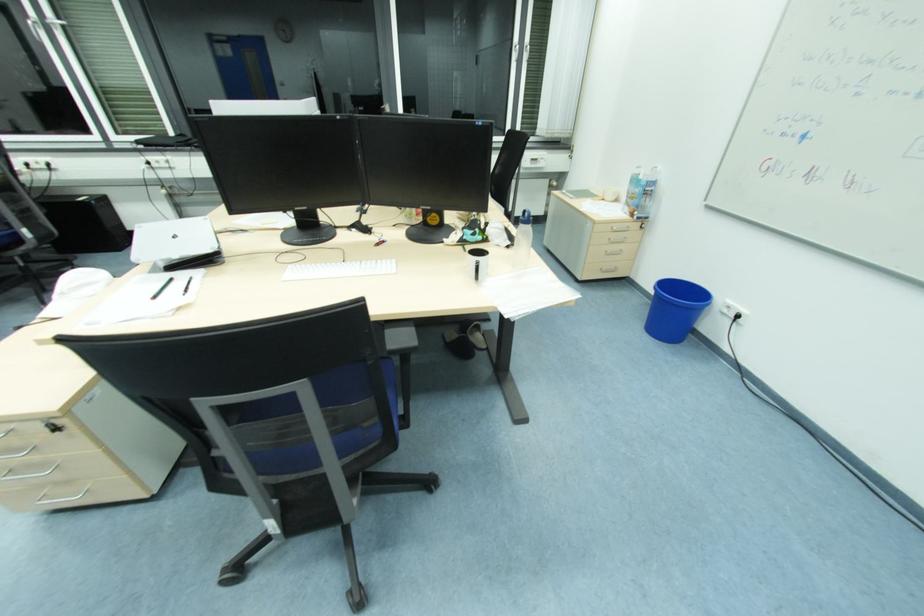
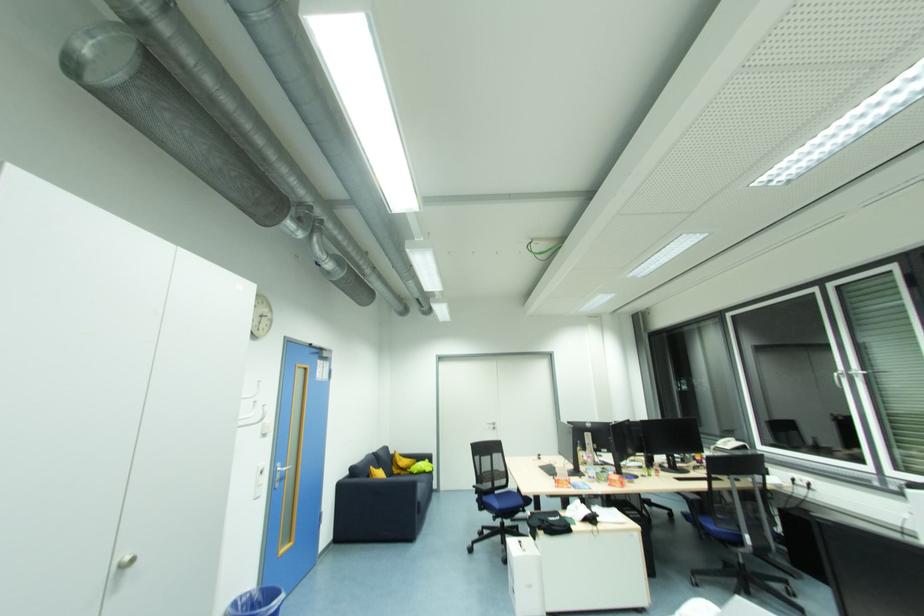
Question: How did the camera likely rotate?

Choices:
 (A) Left
 (B) Right
 (C) Up
 (D) Down

Answer: (A)